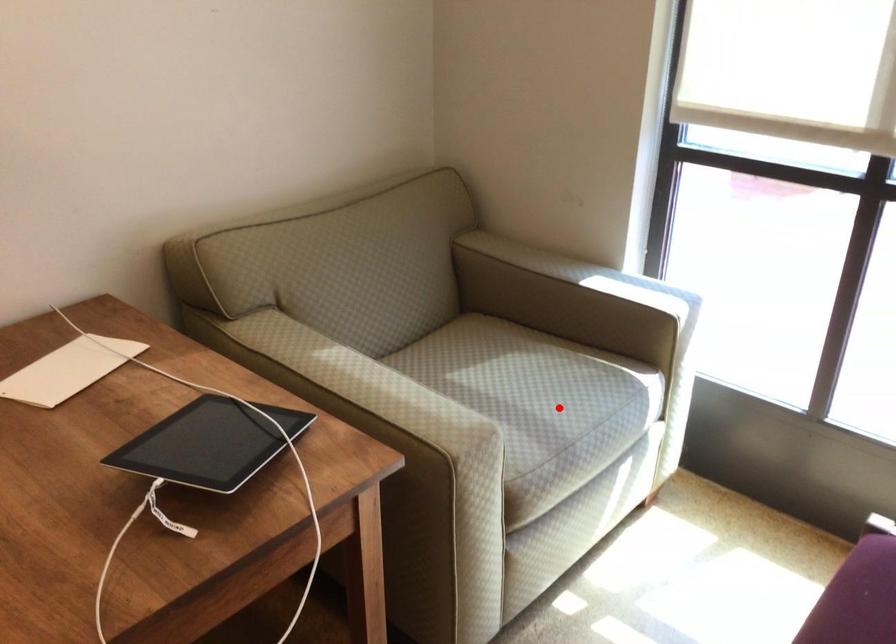
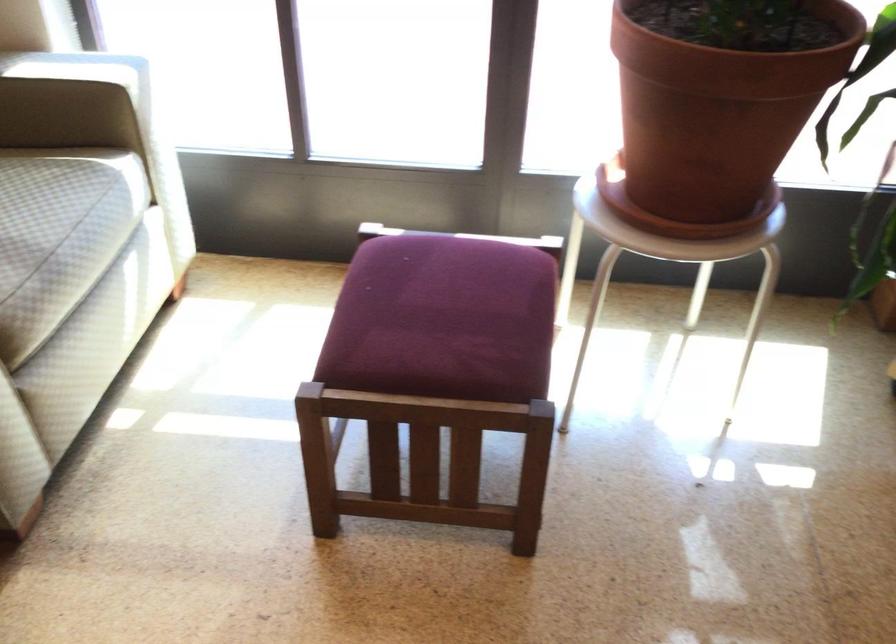
The point at the highlighted location is marked in the first image. Where is the corresponding point in the second image?

(35, 214)